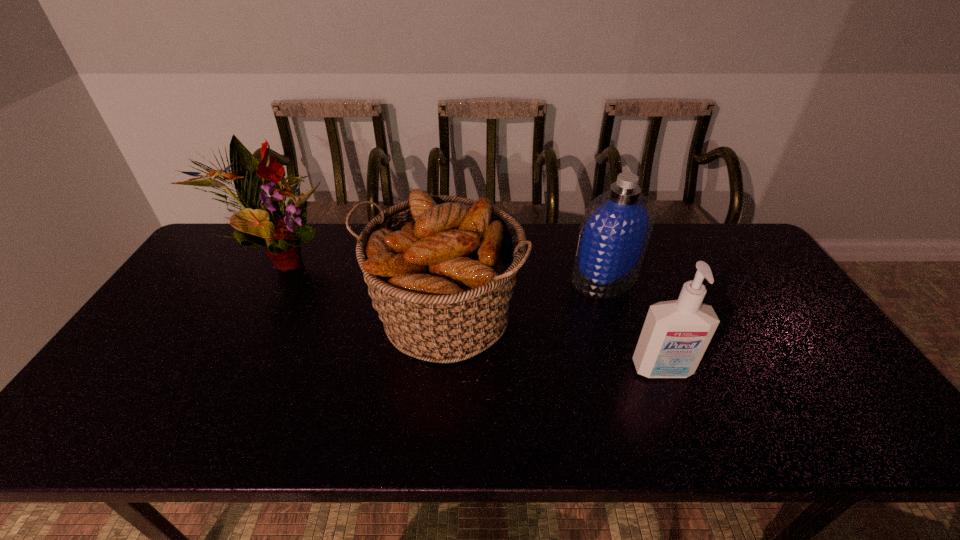
I want to click on free spot between the farther cleansing agent and the nearer cleansing agent, so click(x=634, y=324).

Where is `free spot between the nearer cleansing agent and the farther cleansing agent`? Image resolution: width=960 pixels, height=540 pixels. free spot between the nearer cleansing agent and the farther cleansing agent is located at coordinates (634, 324).

The width and height of the screenshot is (960, 540). What are the coordinates of `vacant area that lies between the nearer cleansing agent and the basket` in the screenshot? It's located at (553, 343).

Locate an element on the screen. The width and height of the screenshot is (960, 540). free area in between the bouquet and the second object from left to right is located at coordinates (361, 288).

Find the location of a particular element. The width and height of the screenshot is (960, 540). vacant area between the farther cleansing agent and the nearer cleansing agent is located at coordinates (634, 324).

Identify which object is the second nearest to the basket. Please provide its 2D coordinates. Your answer should be formatted as a tuple, i.e. [(x, y)], where the tuple contains the x and y coordinates of a point satisfying the conditions above.

[(265, 221)]

At what (x,y) coordinates should I click in order to perform the action: click on object that stands as the second closest to the farther cleansing agent. Please return your answer as a coordinate pair (x, y). The height and width of the screenshot is (540, 960). Looking at the image, I should click on (675, 335).

You are a GUI agent. You are given a task and a screenshot of the screen. Output one action in this format:
    pyautogui.click(x=<x>, y=<y>)
    Task: Click on the free space that satisfies the following two spatial constraints: 1. on the front-facing side of the farther cleansing agent; 2. on the left side of the bouquet
    This screenshot has height=540, width=960.
    Given the screenshot: What is the action you would take?
    pyautogui.click(x=268, y=278)

Find the location of `free region that satisfies the following two spatial constraints: 1. on the back side of the second object from left to right; 2. on the front-facing side of the leftmost object`. free region that satisfies the following two spatial constraints: 1. on the back side of the second object from left to right; 2. on the front-facing side of the leftmost object is located at coordinates (448, 259).

Identify the location of free space that satisfies the following two spatial constraints: 1. on the front-facing side of the leftmost object; 2. on the right side of the basket. (247, 317).